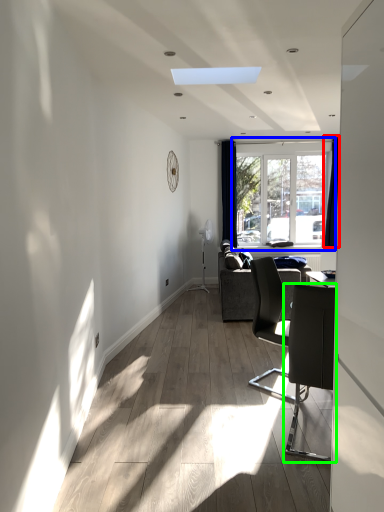
Question: Estimate the real-world distances between objects in this image. Which object is farther from curtain (highlighted by a red box), window (highlighted by a blue box) or chair (highlighted by a green box)?

Choices:
 (A) window
 (B) chair

Answer: (B)